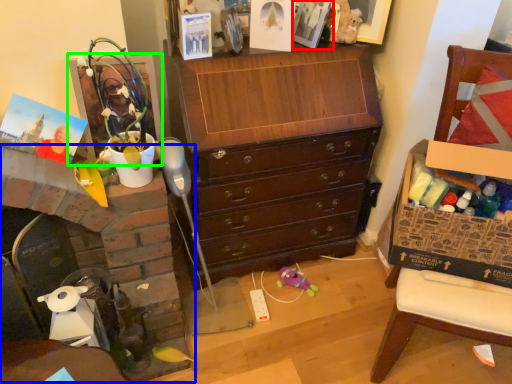
Question: Estimate the real-world distances between objects in this image. Which object is closer to picture frame (highlighted by a red box), fireplace (highlighted by a blue box) or picture frame (highlighted by a green box)?

Choices:
 (A) fireplace
 (B) picture frame

Answer: (B)